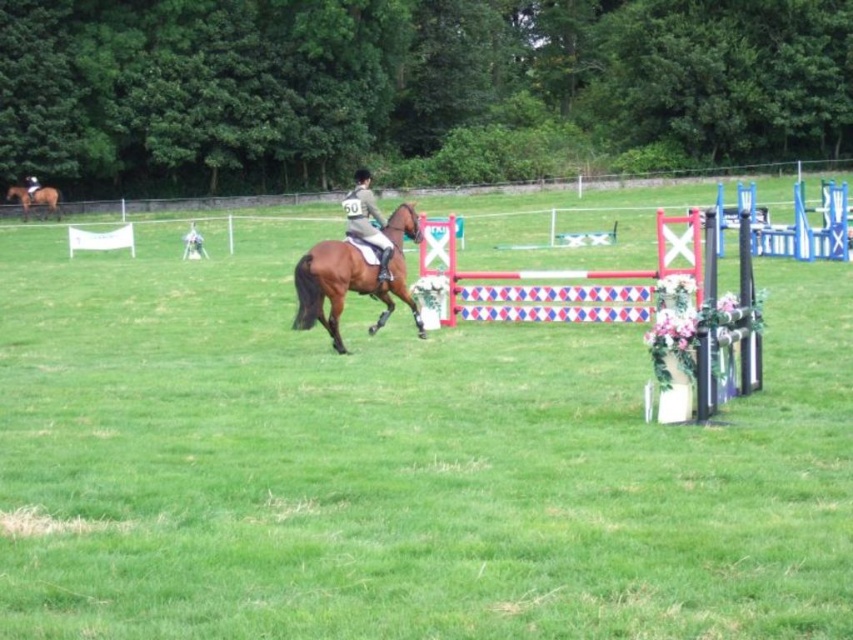
You are a photographer at the equestrian event and need to position your camera to capture both the brown glossy horse at upper left and the dark brown leather jacket at center. Given their sizes, which object should you focus on first to ensure it fits in the frame?

The brown glossy horse at upper left is not as tall as the dark brown leather jacket at center, so you should focus on the dark brown leather jacket at center first to ensure it fits in the frame since it is taller.

You are a spectator at the equestrian event and want to take a photo of both the light brown leather jacket at center and the dark brown leather jacket at center. Which jacket should you focus on first to ensure both are in the frame?

The light brown leather jacket at center is below the dark brown leather jacket at center, so you should focus on the dark brown leather jacket at center first to ensure both are in the frame.

You are a photographer positioned at the center of the field. You need to capture a photo of the brown glossy horse at upper left. Based on its coordinates, which direction should you move to get a better shot?

The brown glossy horse at upper left is located at point (35, 198), which means it is positioned towards the upper left of the image. To center the horse in your photo, you should move towards the upper left direction to align with its position.